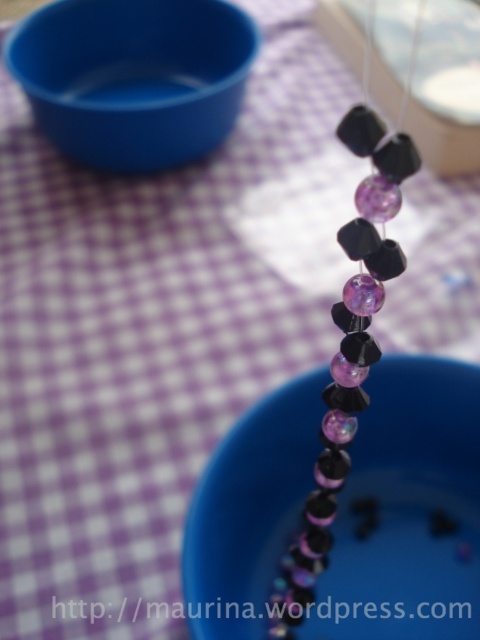
From the picture: You are looking at the image of beads and bowls. There are two points marked in the scene, one at coordinates point (93, 8) and the other at point (367, 140). Which of these points is closer to you?

Point (93, 8) is closer to you because it is further to the camera than point (367, 140).

You are trying to retrieve the translucent glass beads at center from the blue plastic bowl at upper left. Can you reach them without moving the bowl?

The blue plastic bowl at upper left is positioned over the translucent glass beads at center, so you cannot reach the beads without moving the bowl.

You are organizing beads on a table. You have a blue plastic bowl at upper left and translucent glass beads at center. Which object is taller?

The translucent glass beads at center are taller than the blue plastic bowl at upper left.